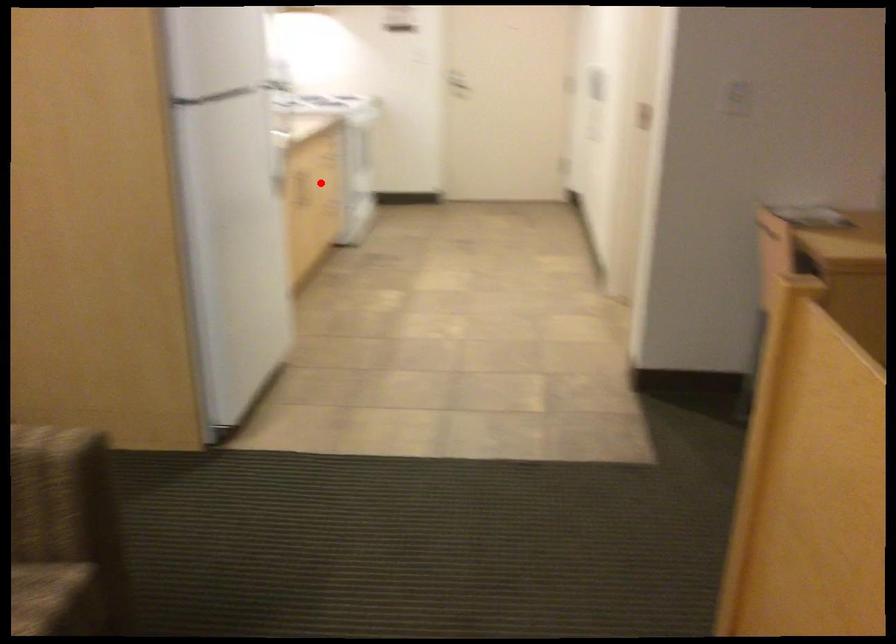
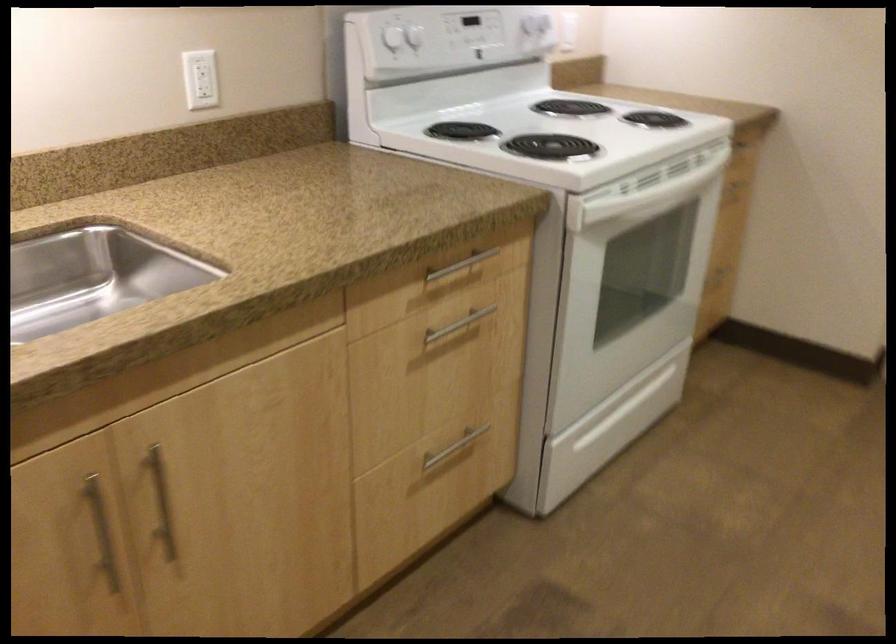
Where in the second image is the point corresponding to the highlighted location from the first image?

(161, 502)